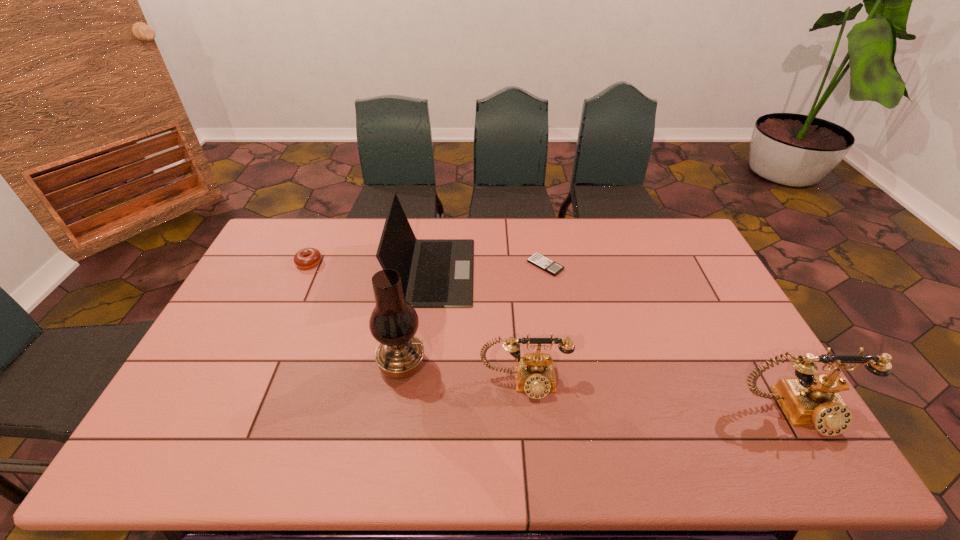
At what (x,y) coordinates should I click in order to perform the action: click on free space between the laptop and the shorter telephone. Please return your answer as a coordinate pair (x, y). The height and width of the screenshot is (540, 960). Looking at the image, I should click on (479, 327).

Find the location of a particular element. Image resolution: width=960 pixels, height=540 pixels. the third closest object relative to the tallest object is located at coordinates (308, 257).

This screenshot has width=960, height=540. I want to click on the closest object to the doughnut, so click(434, 272).